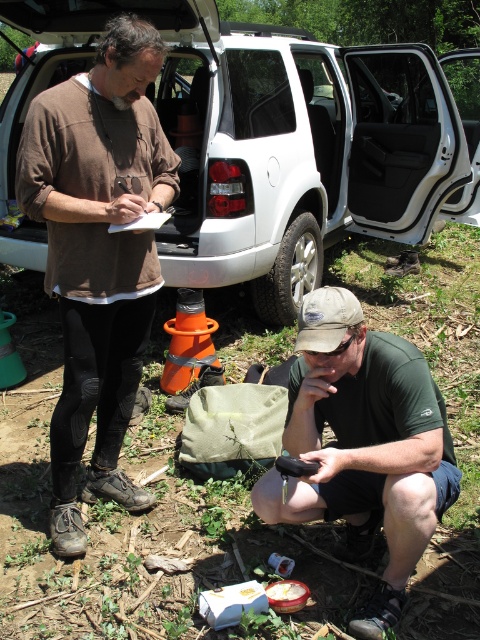
Is white matte suv at center smaller than brown matte shirt at upper left?

Actually, white matte suv at center might be larger than brown matte shirt at upper left.

Can you confirm if white matte suv at center is positioned below brown matte shirt at upper left?

Actually, white matte suv at center is above brown matte shirt at upper left.

Locate an element on the screen. The image size is (480, 640). white matte suv at center is located at coordinates (274, 138).

Can you confirm if white matte suv at center is positioned to the right of green fabric bag at lower center?

Yes, white matte suv at center is to the right of green fabric bag at lower center.

Is point (186, 180) farther from camera compared to point (330, 502)?

Yes, it is.

Where is `white matte suv at center`? The image size is (480, 640). white matte suv at center is located at coordinates (274, 138).

Based on the photo, who is shorter, brown matte shirt at upper left or green fabric bag at lower center?

Standing shorter between the two is green fabric bag at lower center.

Can you confirm if brown matte shirt at upper left is positioned to the right of green fabric bag at lower center?

No, brown matte shirt at upper left is not to the right of green fabric bag at lower center.

Between point (61, 465) and point (335, 337), which one is positioned behind?

The point (61, 465) is more distant.

This screenshot has width=480, height=640. Identify the location of brown matte shirt at upper left. (97, 253).